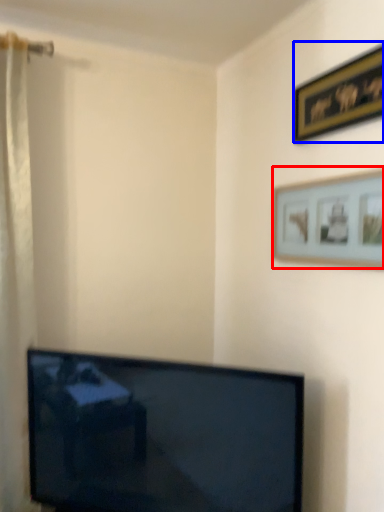
Question: Which of the following is the closest to the observer, picture frame (highlighted by a red box) or picture frame (highlighted by a blue box)?

Choices:
 (A) picture frame
 (B) picture frame

Answer: (A)